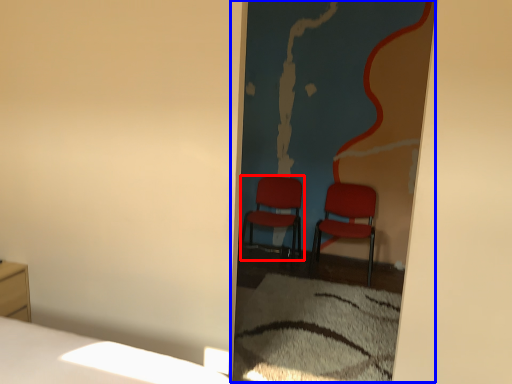
Question: Which object appears closest to the camera in this image, chair (highlighted by a red box) or screen door (highlighted by a blue box)?

Choices:
 (A) chair
 (B) screen door

Answer: (B)